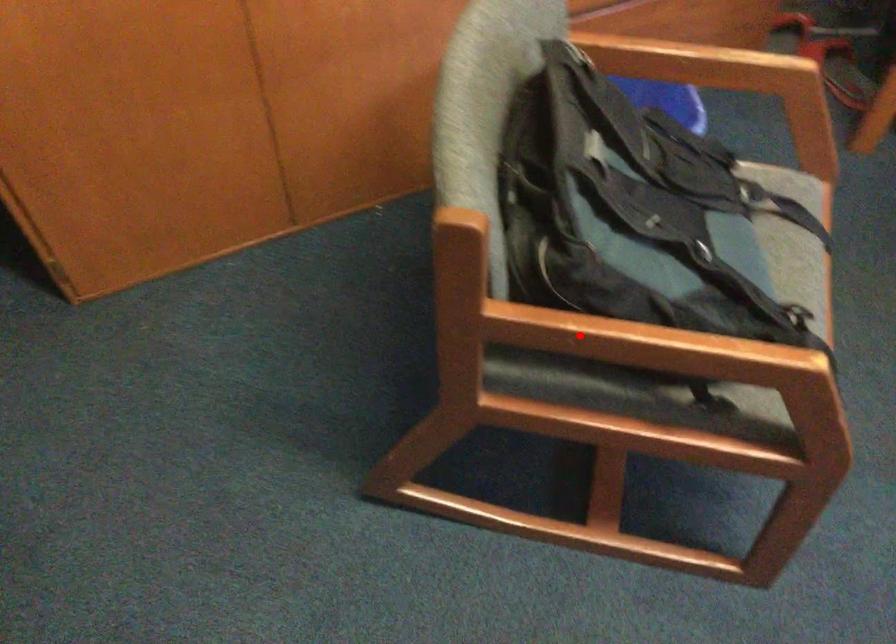
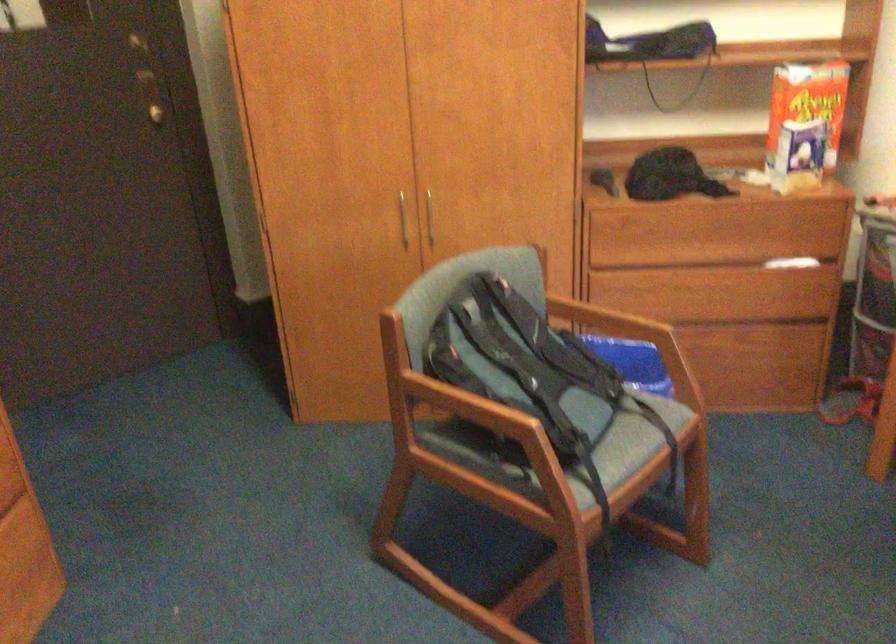
Question: I am providing you with two images of the same scene from different viewpoints. Given a red point in image1, look at the same physical point in image2. Is it:

Choices:
 (A) Closer to the viewpoint
 (B) Farther from the viewpoint

Answer: (B)